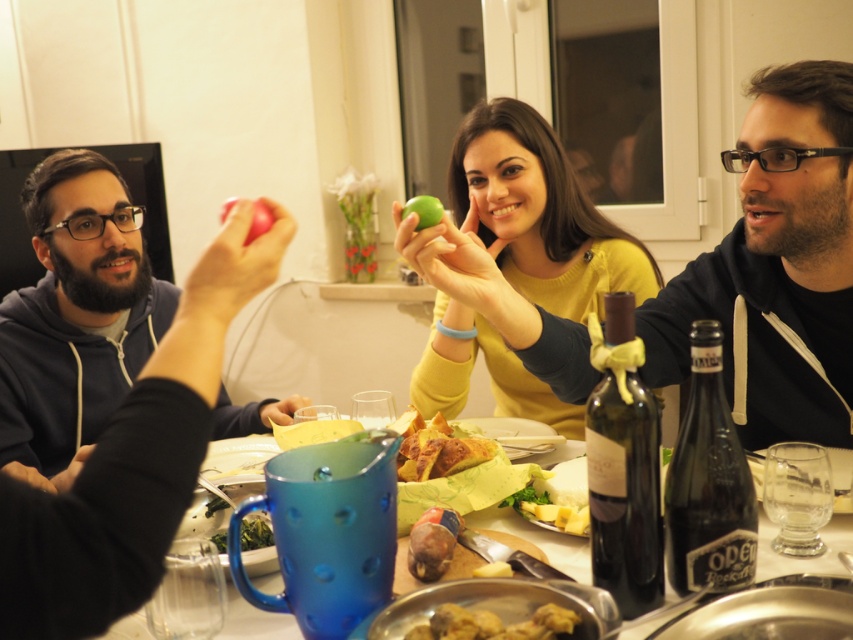
You are a waiter who needs to place a 3.2 feet long tray between the green matte apple at center and the golden brown meatballs at lower center. Can the tray fit in the space between them?

The distance between the green matte apple at center and the golden brown meatballs at lower center is 3.30 feet. Since the tray is 3.2 feet long, it can fit in the space between them as it is slightly shorter than the available distance.